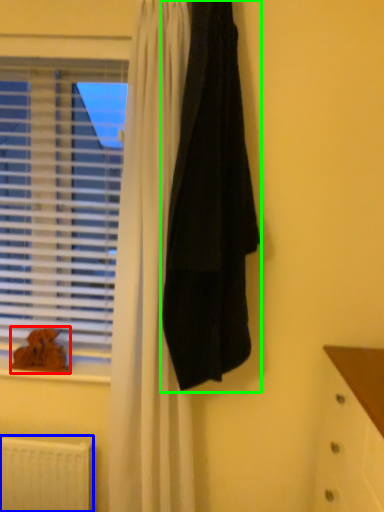
Question: Which object is the closest to the animal (highlighted by a red box)? Choose among these: radiator (highlighted by a blue box) or towel (highlighted by a green box).

Choices:
 (A) radiator
 (B) towel

Answer: (A)